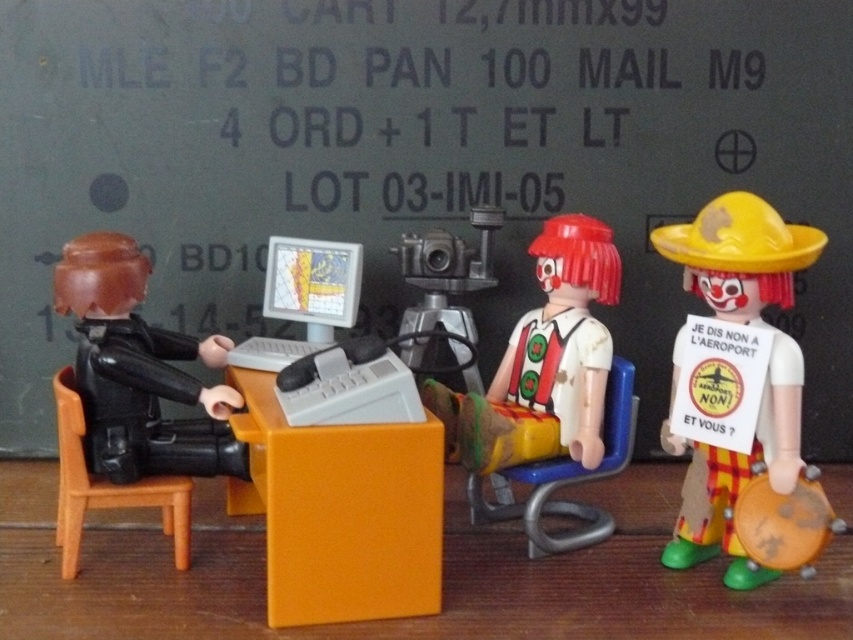
Question: Can you confirm if blue plastic chair at center is positioned to the left of orange plastic chair at left?

Choices:
 (A) yes
 (B) no

Answer: (B)

Question: Which point is closer to the camera taking this photo?

Choices:
 (A) (566, 326)
 (B) (236, 458)

Answer: (B)

Question: Is matte black bulletin board at center bigger than orange plastic chair at left?

Choices:
 (A) no
 (B) yes

Answer: (B)

Question: Which point is closer to the camera taking this photo?

Choices:
 (A) (550, 248)
 (B) (741, 269)

Answer: (B)

Question: Can you confirm if matte black bulletin board at center is bigger than white plastic clown at center?

Choices:
 (A) yes
 (B) no

Answer: (A)

Question: Which object is the farthest from the blue plastic chair at center?

Choices:
 (A) matte black figure at left
 (B) orange plastic table at center

Answer: (A)